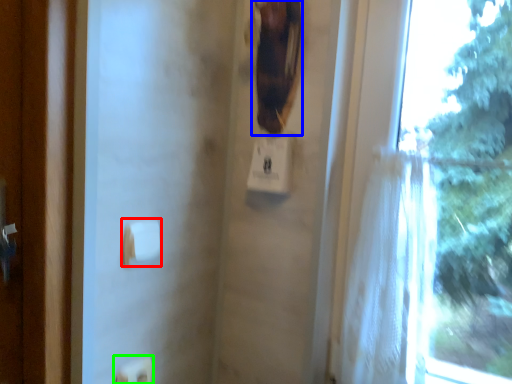
Question: Which is farther away from towel bar (highlighted by a red box)? animal (highlighted by a blue box) or light switch (highlighted by a green box)?

Choices:
 (A) animal
 (B) light switch

Answer: (A)